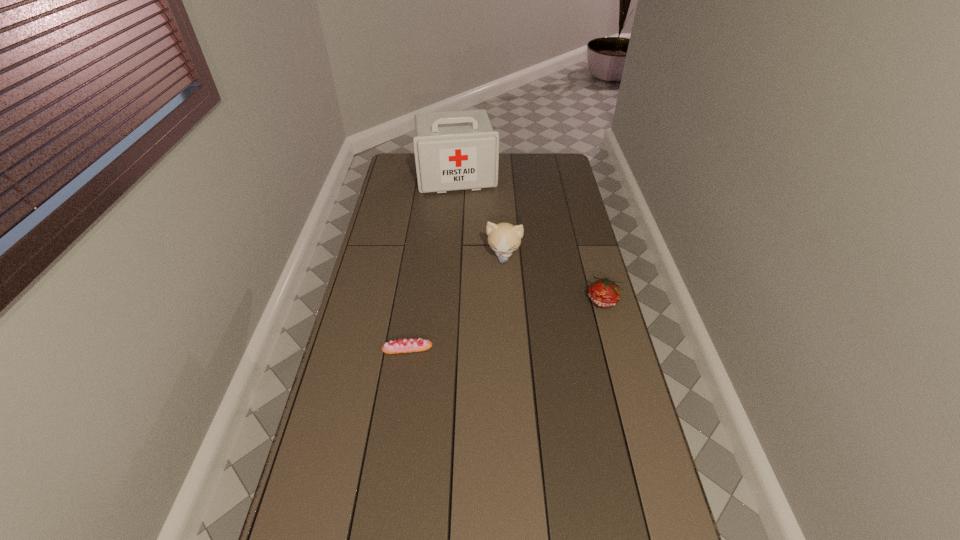
This screenshot has width=960, height=540. Identify the location of free spot on the desktop that is between the shortest object and the tomato and is positioned on the face of the kitten. (492, 328).

Locate an element on the screen. vacant space on the desktop that is between the eclair and the second nearest object and is positioned on the front-facing side of the first-aid kit is located at coordinates (489, 328).